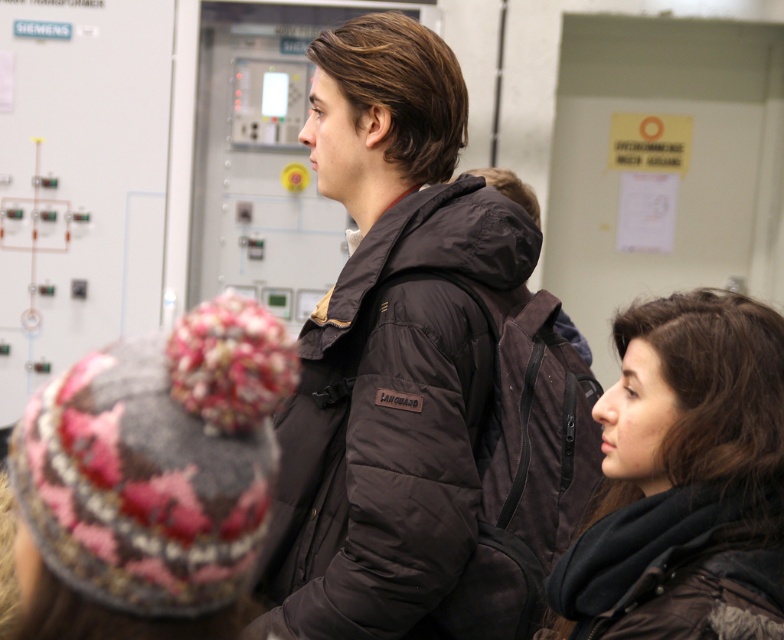
Question: Which point is farther to the camera?

Choices:
 (A) dark brown puffer jacket at center
 (B) dark brown hair at center

Answer: (A)

Question: Is the position of dark brown puffer jacket at center less distant than that of dark brown hair at center?

Choices:
 (A) yes
 (B) no

Answer: (B)

Question: Is dark brown puffer jacket at center wider than dark brown hair at center?

Choices:
 (A) yes
 (B) no

Answer: (A)

Question: Which of the following is the closest to the observer?

Choices:
 (A) (351, 416)
 (B) (659, 547)

Answer: (B)

Question: Which object is farther from the camera taking this photo?

Choices:
 (A) dark brown hair at center
 (B) dark brown puffer jacket at center

Answer: (B)

Question: Is dark brown puffer jacket at center to the right of dark brown hair at center from the viewer's perspective?

Choices:
 (A) no
 (B) yes

Answer: (A)